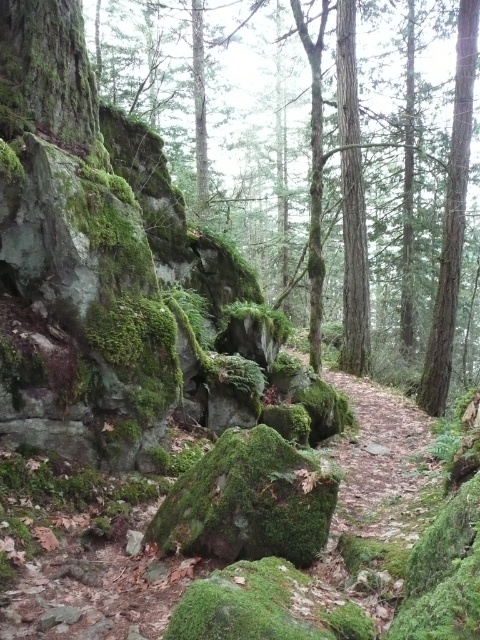
Question: Which of the following is the closest to the observer?

Choices:
 (A) (363, 186)
 (B) (343, 529)

Answer: (B)

Question: Which point is closer to the camera taking this photo?

Choices:
 (A) (443, 134)
 (B) (418, 524)

Answer: (B)

Question: Is green mossy rock at center thinner than brown dirt path at center?

Choices:
 (A) no
 (B) yes

Answer: (A)

Question: Does green mossy rock at center appear over brown dirt path at center?

Choices:
 (A) no
 (B) yes

Answer: (B)

Question: Can you confirm if green mossy rock at center is smaller than brown dirt path at center?

Choices:
 (A) no
 (B) yes

Answer: (A)